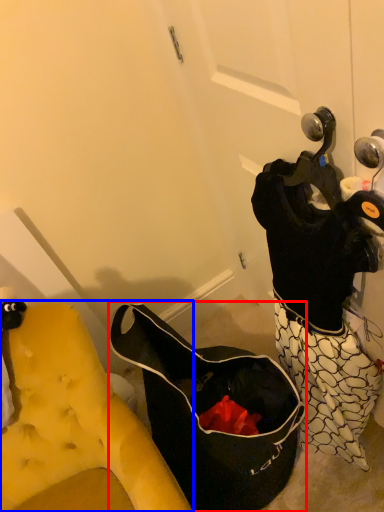
Question: Which point is closer to the camera, handbag (highlighted by a red box) or furniture (highlighted by a blue box)?

Choices:
 (A) handbag
 (B) furniture

Answer: (B)